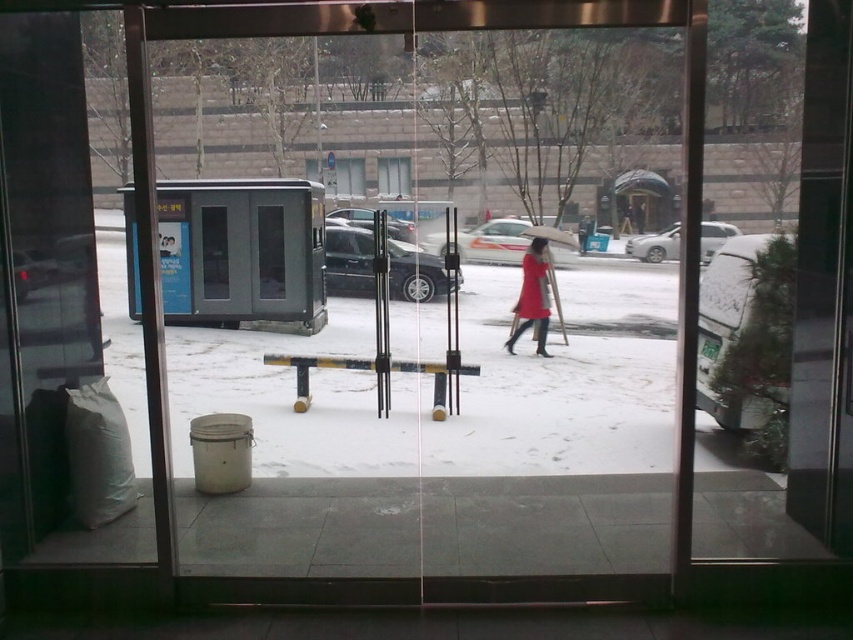
You are standing inside a building and looking through the glass door. You see the matte red coat at center and the clear glass window at center. Which object is closer to the floor?

The matte red coat at center is below the clear glass window at center, so it is closer to the floor.